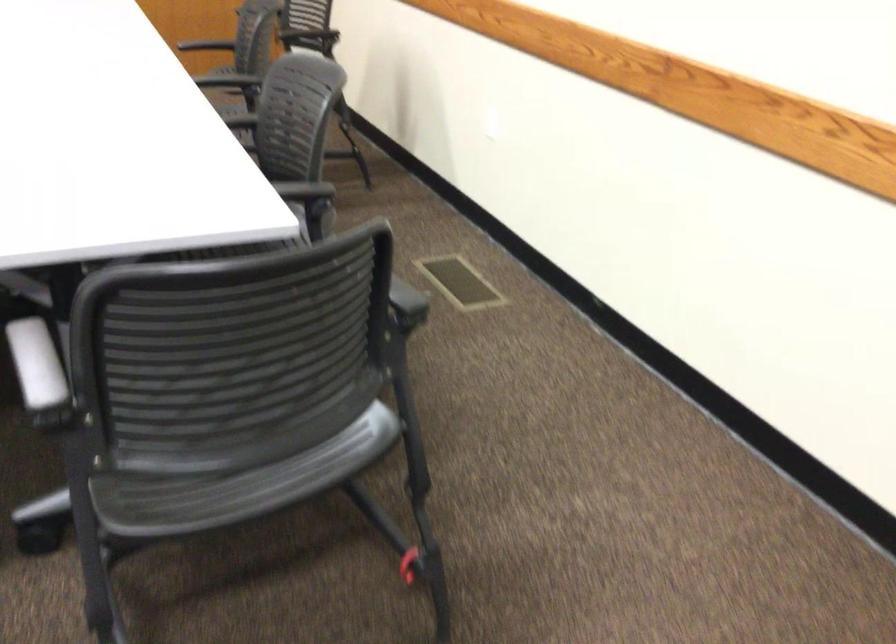
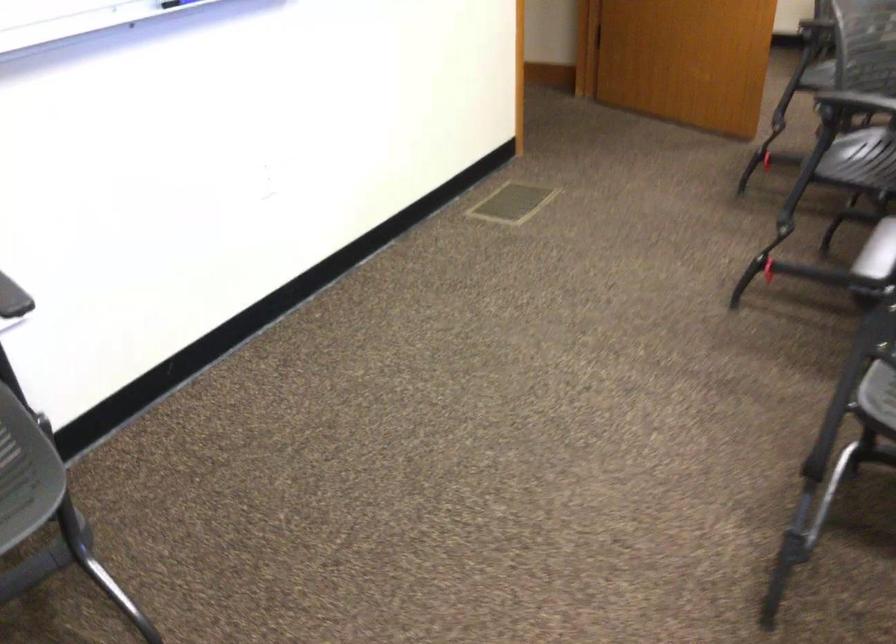
Question: Based on the continuous images, in which direction is the camera rotating? Reply with the corresponding letter.

Choices:
 (A) Left
 (B) Right
 (C) Up
 (D) Down

Answer: (A)